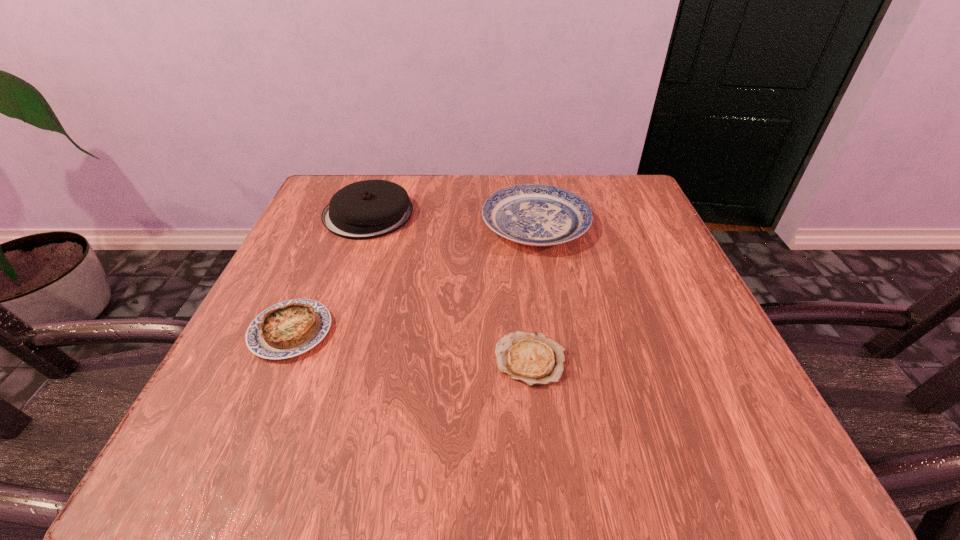
Find the location of `pancake at the far edge`. pancake at the far edge is located at coordinates (368, 209).

Locate an element on the screen. The image size is (960, 540). plate that is at the far edge is located at coordinates click(x=531, y=214).

I want to click on pancake that is at the left edge, so click(x=368, y=209).

Where is `quiche that is at the left edge`? quiche that is at the left edge is located at coordinates (287, 329).

Identify the location of object that is at the right edge. The width and height of the screenshot is (960, 540). (531, 214).

At what (x,y) coordinates should I click in order to perform the action: click on object that is at the far left corner. Please return your answer as a coordinate pair (x, y). Looking at the image, I should click on (368, 209).

Locate an element on the screen. object located at the far right corner is located at coordinates (531, 214).

The image size is (960, 540). I want to click on vacant space at the far edge of the desktop, so click(x=452, y=184).

I want to click on vacant point at the near edge, so click(x=405, y=414).

Where is `vacant region at the left edge of the desktop`? This screenshot has width=960, height=540. vacant region at the left edge of the desktop is located at coordinates (301, 246).